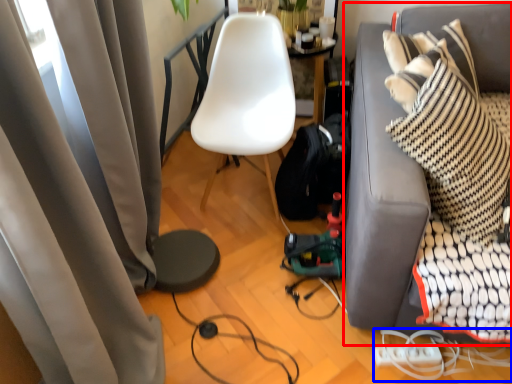
Question: Which of the following is the closest to the observer, studio couch (highlighted by a red box) or cable (highlighted by a blue box)?

Choices:
 (A) studio couch
 (B) cable

Answer: (A)